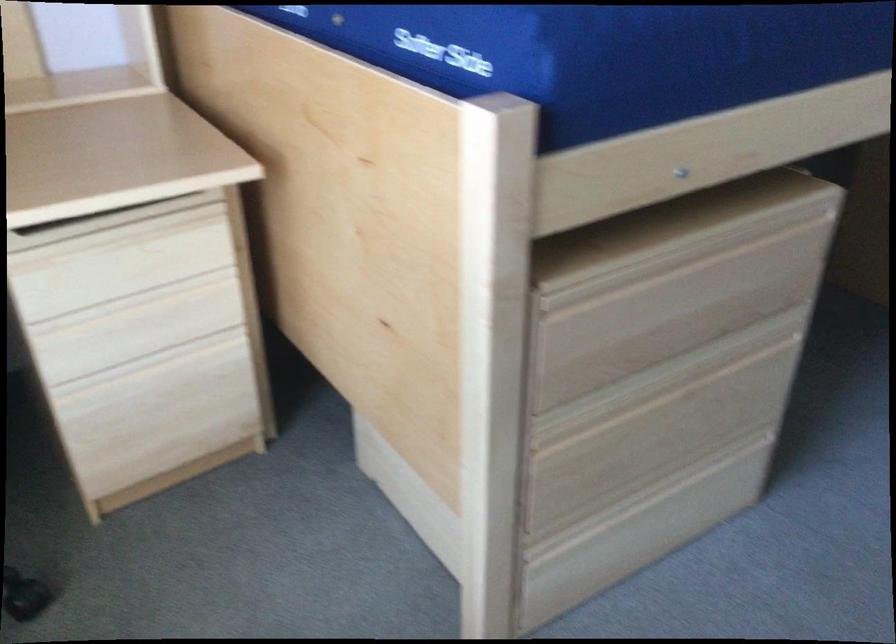
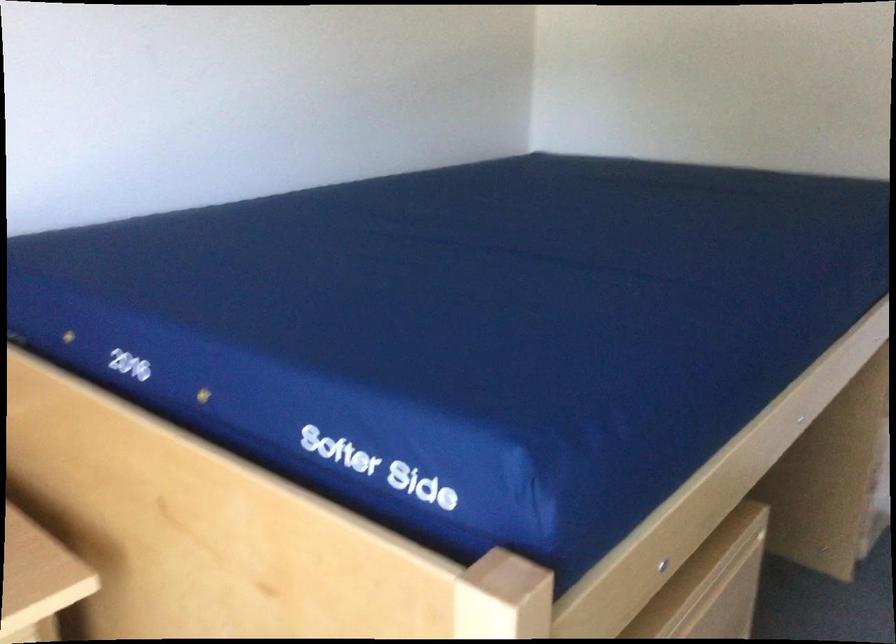
What movement of the cameraman would produce the second image?

The cameraman walked toward left, forward.